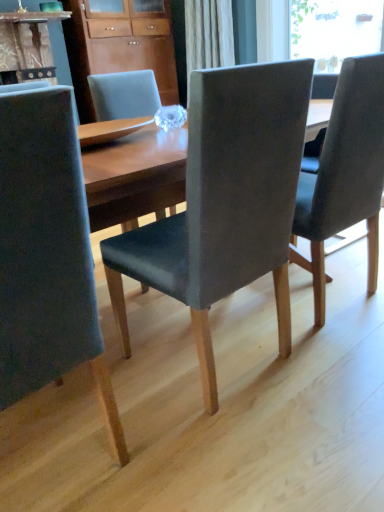
Find the location of a particular element. vacant space underneath matte gray chair at center, positioned as the second chair in right-to-left order (from a real-world perspective) is located at coordinates (217, 358).